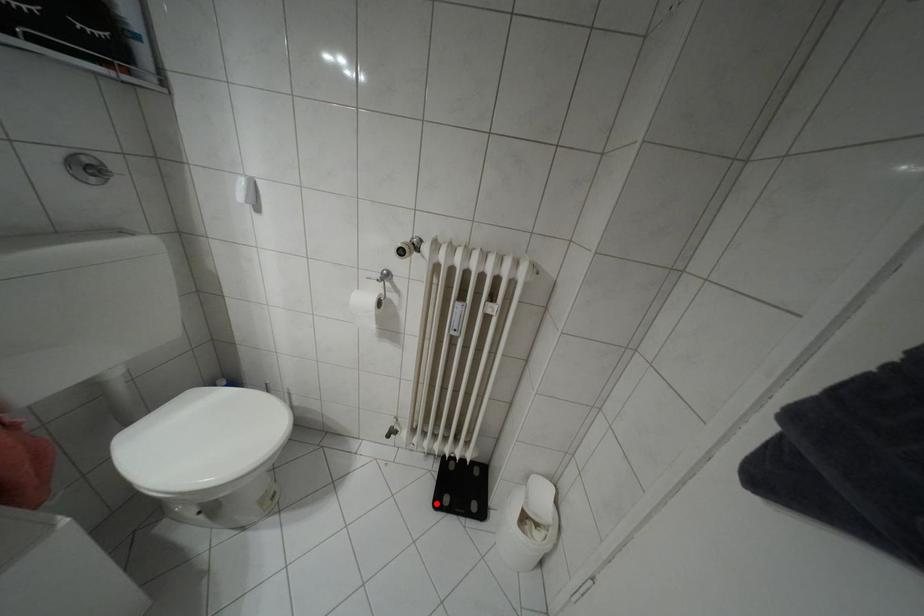
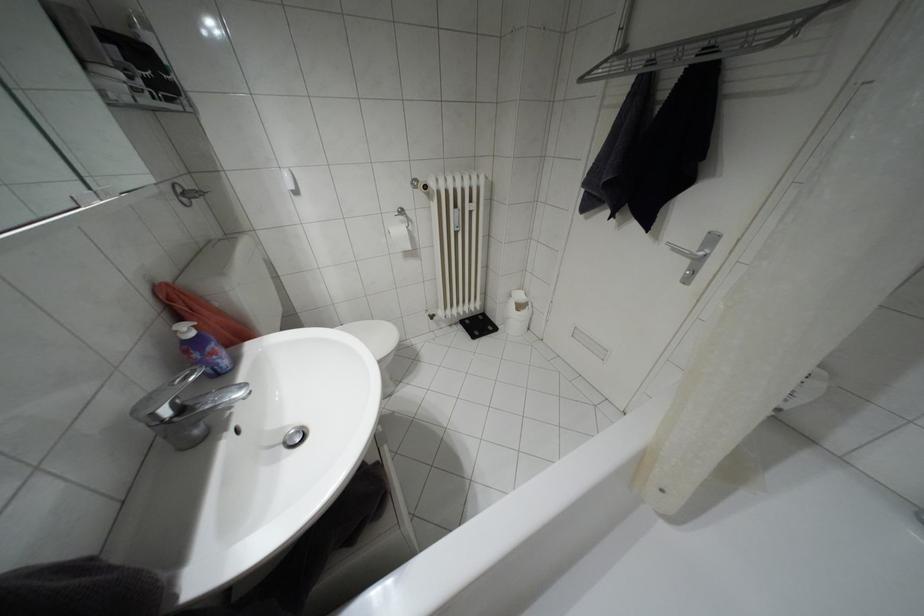
Find the pixel in the second image that matches the highlighted location in the first image.

(472, 336)